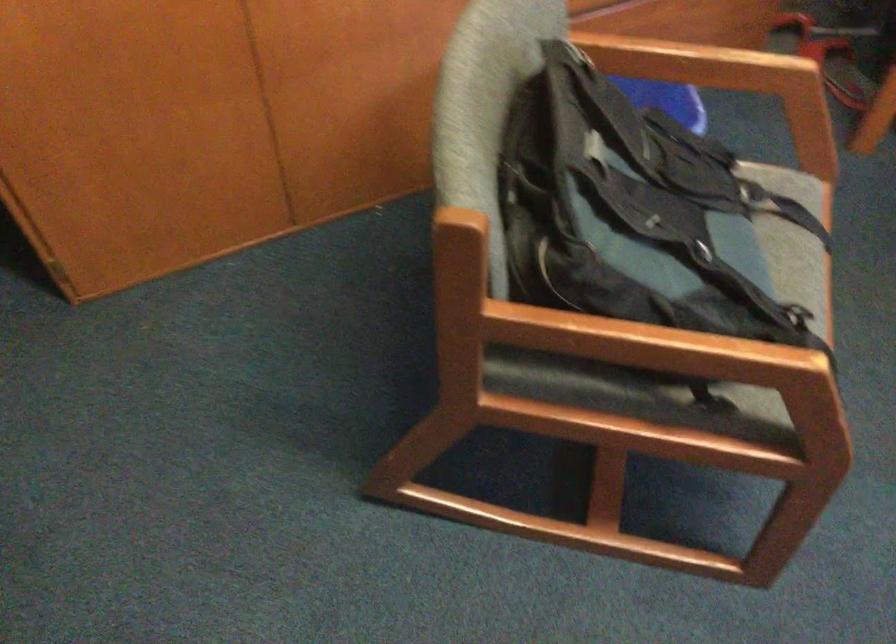
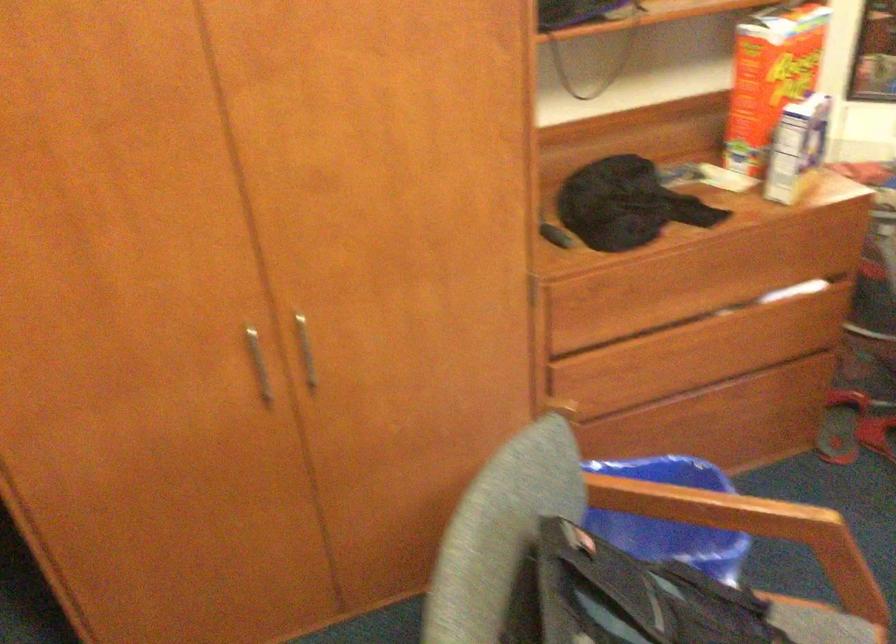
The images are taken continuously from a first-person perspective. In which direction are you moving?

The cameraman moved toward right, backward.